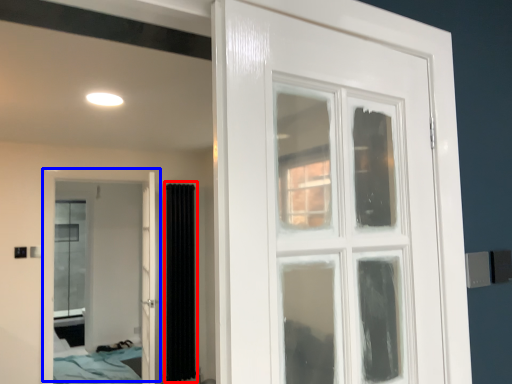
Question: Which object appears farthest to the camera in this image, curtain (highlighted by a red box) or door (highlighted by a blue box)?

Choices:
 (A) curtain
 (B) door

Answer: (A)